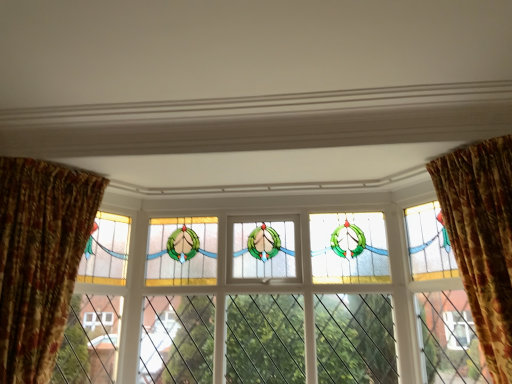
Question: Does point (457, 365) appear closer or farther from the camera than point (67, 314)?

Choices:
 (A) closer
 (B) farther

Answer: (B)

Question: From the image's perspective, is stained glass window at right located above or below floral velvet curtain at left, which is the second curtain in right-to-left order?

Choices:
 (A) below
 (B) above

Answer: (A)

Question: Estimate the real-world distances between objects in this image. Which object is farther from the floral fabric curtain at right, which is counted as the first curtain, starting from the right?

Choices:
 (A) stained glass window at center
 (B) stained glass window at right
 (C) floral velvet curtain at left, which is the second curtain in right-to-left order

Answer: (C)

Question: Based on their relative distances, which object is nearer to the floral velvet curtain at left, which is the second curtain in right-to-left order?

Choices:
 (A) stained glass window at center
 (B) floral fabric curtain at right, which appears as the 2th curtain when viewed from the left
 (C) stained glass window at right

Answer: (A)